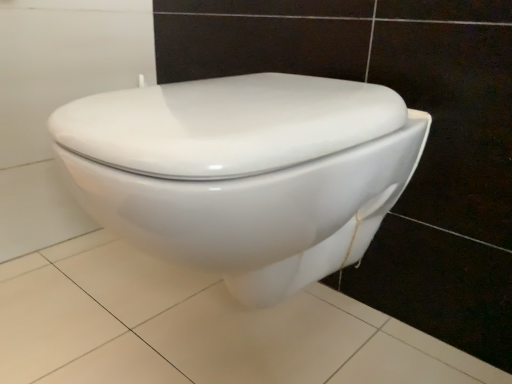
At what (x,y) coordinates should I click in order to perform the action: click on free point below white glossy toilet at center (from a real-world perspective). Please return your answer as a coordinate pair (x, y). This screenshot has height=384, width=512. Looking at the image, I should click on (248, 341).